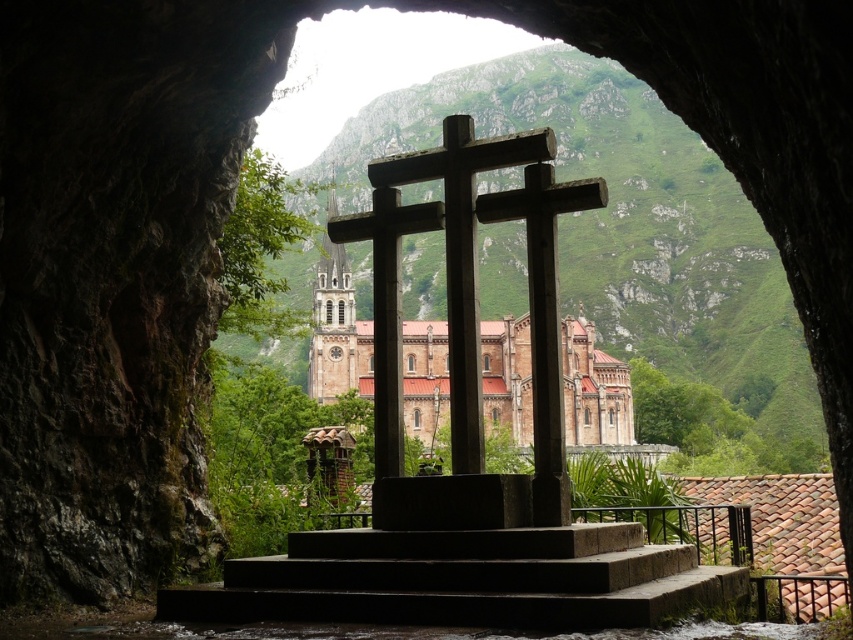
Question: Among these objects, which one is farthest from the camera?

Choices:
 (A) dark gray concrete stairs at center
 (B) rustic wood cross at center

Answer: (B)

Question: Is dark gray concrete stairs at center positioned in front of rustic wood cross at center?

Choices:
 (A) no
 (B) yes

Answer: (B)

Question: Which of the following is the farthest from the observer?

Choices:
 (A) (364, 228)
 (B) (668, 600)

Answer: (A)

Question: Which point is farther to the camera?

Choices:
 (A) dark gray concrete stairs at center
 (B) rustic wood cross at center

Answer: (B)

Question: Is dark gray concrete stairs at center to the left of rustic wood cross at center from the viewer's perspective?

Choices:
 (A) yes
 (B) no

Answer: (B)

Question: Is dark gray concrete stairs at center bigger than rustic wood cross at center?

Choices:
 (A) no
 (B) yes

Answer: (A)